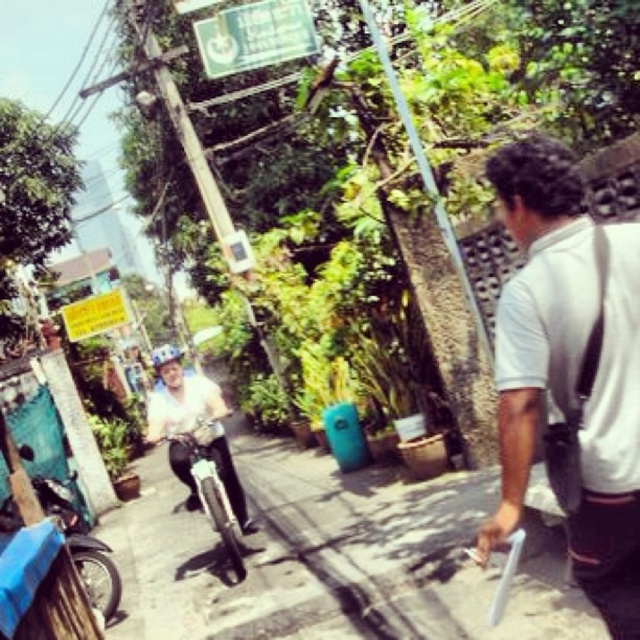
You are a delivery person who needs to park your blue matte motorcycle at lower left near the smooth concrete pavement at center. Can you park it directly in front of the pavement?

The smooth concrete pavement at center is in front of the blue matte motorcycle at lower left, meaning the motorcycle is already positioned behind the pavement. Therefore, you cannot park it directly in front of the pavement as it is already located there.

Consider the image. You are a delivery driver who needs to deliver a package to the address shown on the green plastic sign at upper center. The blue matte motorcycle at lower left is blocking your path. Can you pass the motorcycle without moving it?

The green plastic sign at upper center is taller than the blue matte motorcycle at lower left, so you can pass the motorcycle without moving it by going around it since the sign is taller and might indicate a direction or height clearance that allows passage.